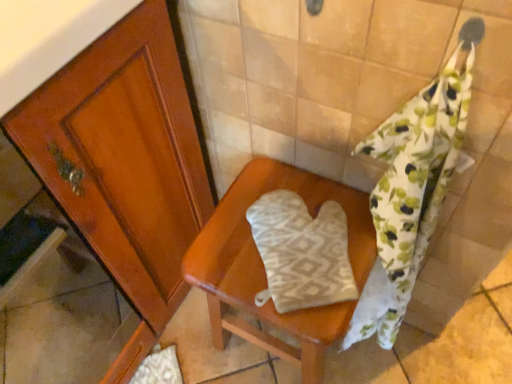
Question: From a real-world perspective, is white textured oven mitt at center below floral cotton towel at right?

Choices:
 (A) no
 (B) yes

Answer: (A)

Question: Can we say white textured oven mitt at center lies outside floral cotton towel at right?

Choices:
 (A) yes
 (B) no

Answer: (A)

Question: Is white textured oven mitt at center directly adjacent to floral cotton towel at right?

Choices:
 (A) yes
 (B) no

Answer: (B)

Question: From a real-world perspective, is white textured oven mitt at center on top of floral cotton towel at right?

Choices:
 (A) no
 (B) yes

Answer: (B)

Question: Could you tell me if white textured oven mitt at center is turned towards floral cotton towel at right?

Choices:
 (A) yes
 (B) no

Answer: (A)

Question: From the image's perspective, is white textured oven mitt at center located above floral cotton towel at right?

Choices:
 (A) no
 (B) yes

Answer: (B)

Question: Is beige fabric oven mitt at center wider than floral cotton towel at right?

Choices:
 (A) no
 (B) yes

Answer: (B)

Question: Can you confirm if beige fabric oven mitt at center is smaller than floral cotton towel at right?

Choices:
 (A) yes
 (B) no

Answer: (B)

Question: Can we say beige fabric oven mitt at center lies outside floral cotton towel at right?

Choices:
 (A) no
 (B) yes

Answer: (B)

Question: Does beige fabric oven mitt at center come in front of floral cotton towel at right?

Choices:
 (A) no
 (B) yes

Answer: (A)

Question: From the image's perspective, is beige fabric oven mitt at center over floral cotton towel at right?

Choices:
 (A) no
 (B) yes

Answer: (A)

Question: Can you confirm if beige fabric oven mitt at center is positioned to the right of floral cotton towel at right?

Choices:
 (A) no
 (B) yes

Answer: (A)

Question: From the image's perspective, would you say floral cotton towel at right is positioned over beige fabric oven mitt at center?

Choices:
 (A) yes
 (B) no

Answer: (A)